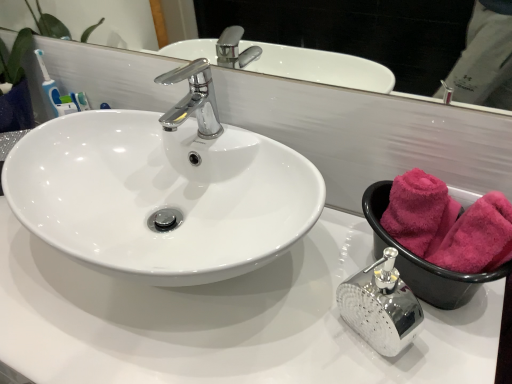
The width and height of the screenshot is (512, 384). Identify the location of free space to the left of polished chrome soap dispenser at lower right. (279, 326).